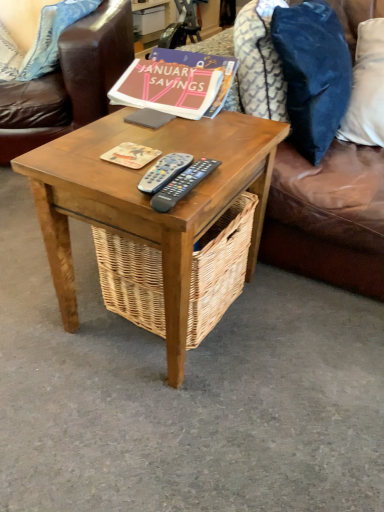
The width and height of the screenshot is (384, 512). What are the coordinates of `vacant area that is situated to the right of woven wood picnic basket at center` in the screenshot? It's located at (291, 321).